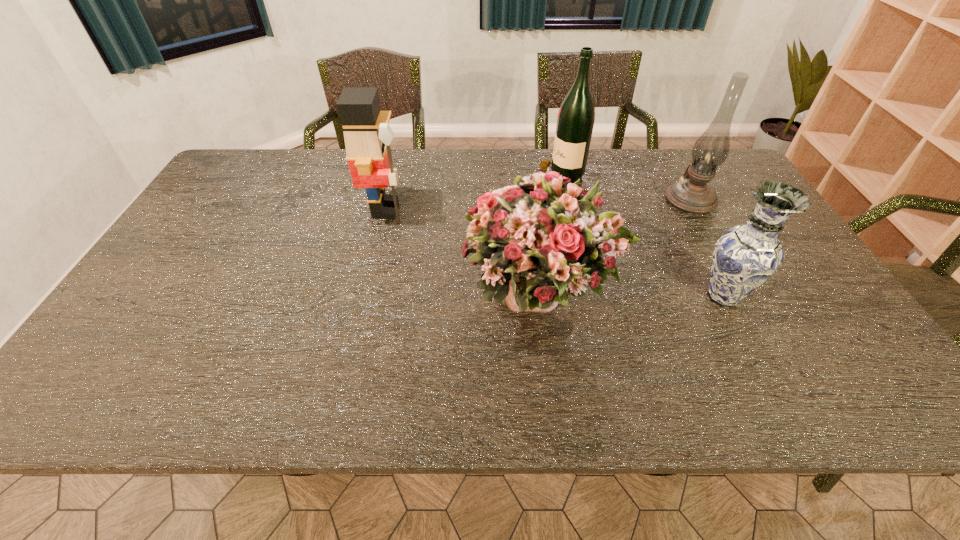
I want to click on free space located 0.380m on the left of the bouquet, so click(x=307, y=294).

Find the location of a particular element. Image resolution: width=960 pixels, height=540 pixels. vacant position located on the front of the vase is located at coordinates (767, 382).

What are the coordinates of `wine bottle that is positioned at the far edge` in the screenshot? It's located at (575, 122).

The width and height of the screenshot is (960, 540). Find the location of `oil lamp that is at the far edge`. oil lamp that is at the far edge is located at coordinates (693, 194).

Where is `object present at the right edge`? The width and height of the screenshot is (960, 540). object present at the right edge is located at coordinates (693, 194).

I want to click on object at the far right corner, so click(x=693, y=194).

At what (x,y) coordinates should I click in order to perform the action: click on vacant space at the far edge. Please return your answer as a coordinate pair (x, y). Looking at the image, I should click on (341, 166).

Identify the location of free space at the near edge of the desktop. (588, 408).

Image resolution: width=960 pixels, height=540 pixels. I want to click on free location at the left edge of the desktop, so click(x=173, y=246).

What are the coordinates of `free region at the right edge of the desktop` in the screenshot? It's located at (791, 305).